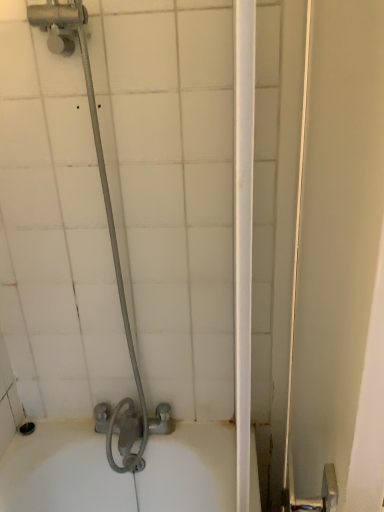
Question: Is white glossy screen door at right smaller than metallic gray showerhead at left?

Choices:
 (A) no
 (B) yes

Answer: (A)

Question: Considering the relative sizes of white glossy screen door at right and metallic gray showerhead at left in the image provided, is white glossy screen door at right taller than metallic gray showerhead at left?

Choices:
 (A) no
 (B) yes

Answer: (B)

Question: Is white glossy screen door at right oriented towards metallic gray showerhead at left?

Choices:
 (A) no
 (B) yes

Answer: (A)

Question: Does white glossy screen door at right appear on the right side of metallic gray showerhead at left?

Choices:
 (A) yes
 (B) no

Answer: (A)

Question: Does white glossy screen door at right appear on the left side of metallic gray showerhead at left?

Choices:
 (A) no
 (B) yes

Answer: (A)

Question: Does white glossy screen door at right have a greater width compared to metallic gray showerhead at left?

Choices:
 (A) yes
 (B) no

Answer: (B)

Question: Would you say metallic gray showerhead at left contains white glossy screen door at right?

Choices:
 (A) no
 (B) yes

Answer: (A)

Question: Is metallic gray showerhead at left aimed at white glossy screen door at right?

Choices:
 (A) yes
 (B) no

Answer: (B)

Question: Can you confirm if metallic gray showerhead at left is smaller than white glossy screen door at right?

Choices:
 (A) no
 (B) yes

Answer: (B)

Question: Is metallic gray showerhead at left directly adjacent to white glossy screen door at right?

Choices:
 (A) no
 (B) yes

Answer: (A)

Question: From the image's perspective, is metallic gray showerhead at left under white glossy screen door at right?

Choices:
 (A) no
 (B) yes

Answer: (A)

Question: Is metallic gray showerhead at left in front of white glossy screen door at right?

Choices:
 (A) yes
 (B) no

Answer: (B)

Question: Is metallic gray showerhead at left to the left or to the right of white glossy screen door at right in the image?

Choices:
 (A) left
 (B) right

Answer: (A)